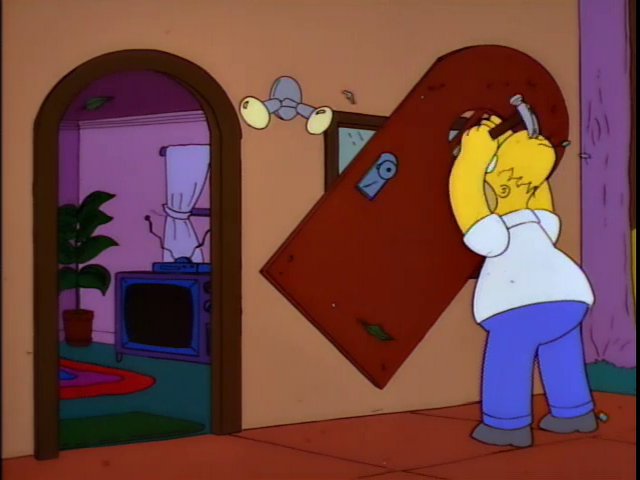
You are a GUI agent. You are given a task and a screenshot of the screen. Output one action in this format:
    pyautogui.click(x=<x>, y=<y>)
    Task: Click on the potted plant
    The width and height of the screenshot is (640, 480).
    Given the screenshot: What is the action you would take?
    pyautogui.click(x=73, y=224)